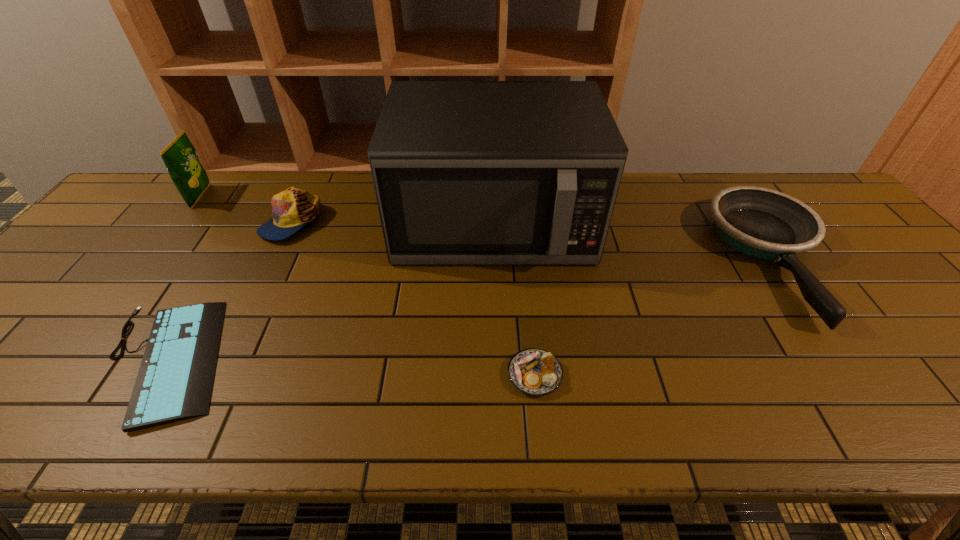
Locate an element on the screen. The width and height of the screenshot is (960, 540). the tallest object is located at coordinates coord(465,172).

You are a GUI agent. You are given a task and a screenshot of the screen. Output one action in this format:
    pyautogui.click(x=<x>, y=<y>)
    Task: Click on the fifth shortest object
    
    Given the screenshot: What is the action you would take?
    pyautogui.click(x=180, y=157)

Identify the location of crisp (potato chip). (180, 157).

Identify the location of cap. (293, 208).

Find the location of a particular element. the rightmost object is located at coordinates (763, 223).

This screenshot has height=540, width=960. I want to click on the fourth tallest object, so click(x=763, y=223).

Where is `the second shortest object`? the second shortest object is located at coordinates (536, 372).

I want to click on computer keyboard, so click(175, 379).

Find the location of a particular element. free location located 0.210m on the front-facing side of the tallest object is located at coordinates (497, 344).

Find the location of a particular element. vacant space located on the front-facing side of the leftmost object is located at coordinates (304, 197).